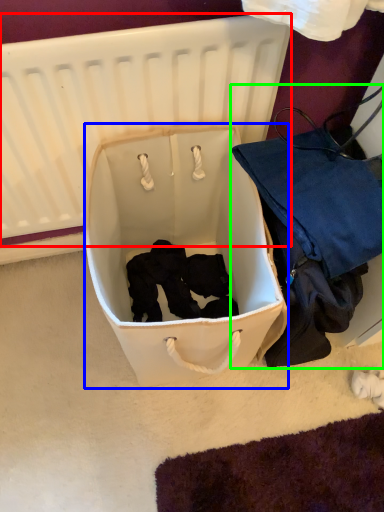
Question: Which is nearer to the infant bed (highlighted by a red box)? storage box (highlighted by a blue box) or luggage and bags (highlighted by a green box).

Choices:
 (A) storage box
 (B) luggage and bags

Answer: (A)